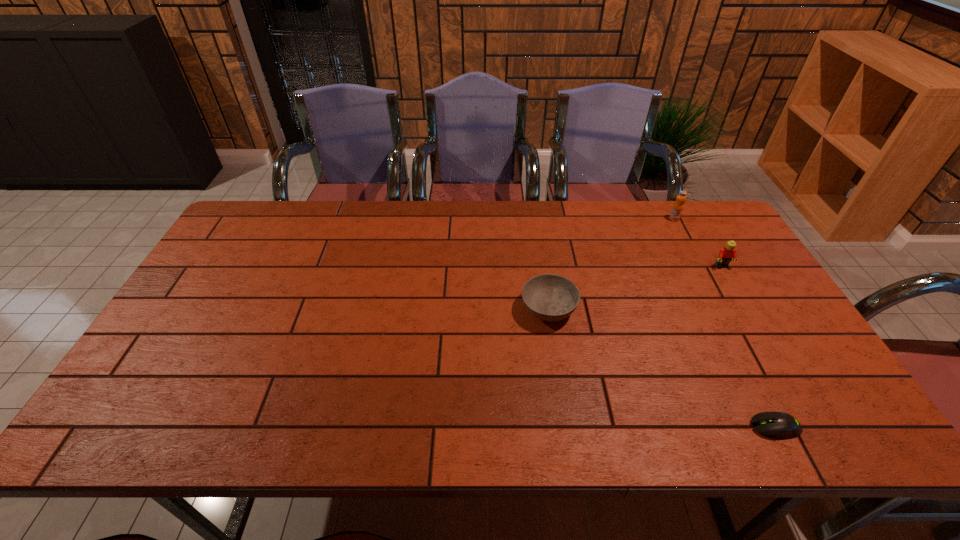
Where is `orange juice`? The image size is (960, 540). orange juice is located at coordinates (678, 206).

You are a GUI agent. You are given a task and a screenshot of the screen. Output one action in this format:
    pyautogui.click(x=<x>, y=<y>)
    Task: Click on the third shortest object
    
    Given the screenshot: What is the action you would take?
    pyautogui.click(x=726, y=254)

Locate an element on the screen. Lego is located at coordinates (726, 254).

This screenshot has width=960, height=540. Identify the location of the third farthest object. (549, 297).

Locate an element on the screen. The width and height of the screenshot is (960, 540). the third tallest object is located at coordinates coord(549,297).

This screenshot has height=540, width=960. Identify the location of the shortest object. (779, 425).

At what (x,y) coordinates should I click in order to perform the action: click on computer mouse. Please return your answer as a coordinate pair (x, y). The height and width of the screenshot is (540, 960). Looking at the image, I should click on (779, 425).

Locate an element on the screen. This screenshot has height=540, width=960. free space located 0.370m on the front label of the farthest object is located at coordinates (717, 301).

Where is `vacant region located on the face of the Lego`? The image size is (960, 540). vacant region located on the face of the Lego is located at coordinates (773, 354).

The width and height of the screenshot is (960, 540). I want to click on free region located 0.080m on the back of the third tallest object, so click(x=542, y=269).